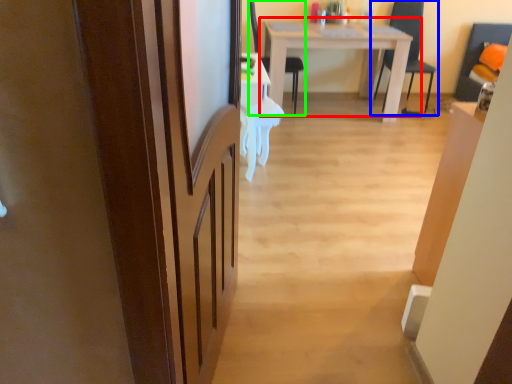
Question: Which object is positioned farthest from table (highlighted by a red box)? Select from chair (highlighted by a blue box) and chair (highlighted by a green box).

Choices:
 (A) chair
 (B) chair

Answer: (A)